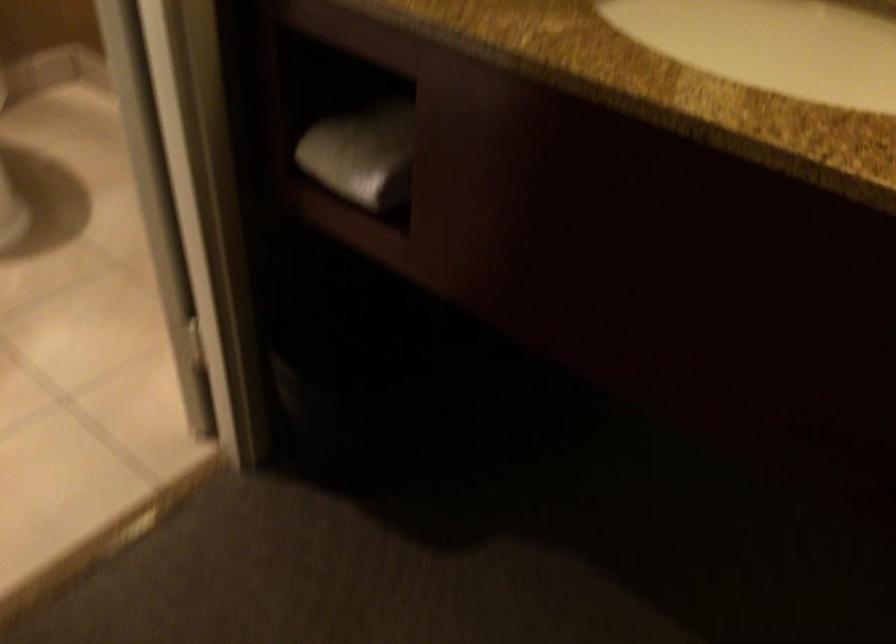
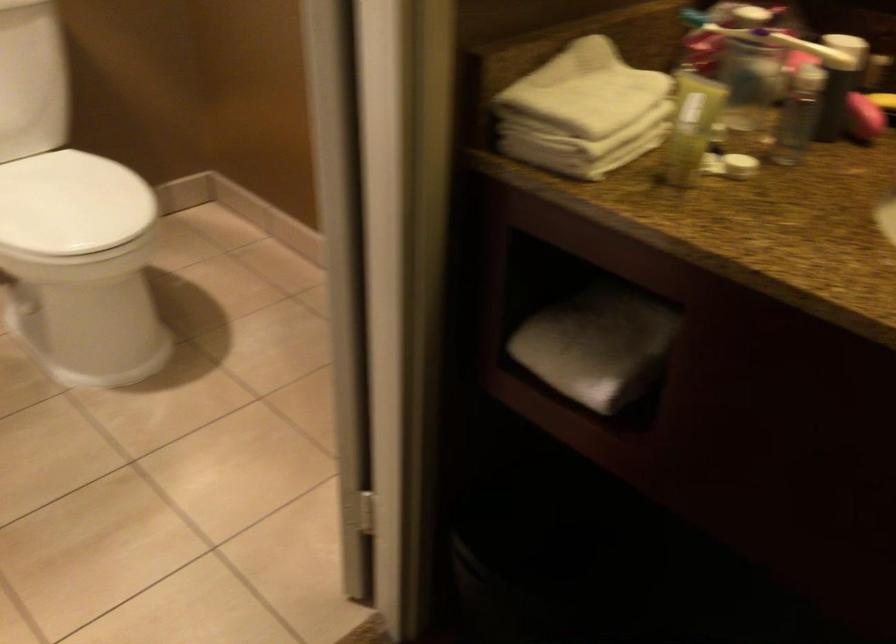
Question: The images are taken continuously from a first-person perspective. In which direction is your viewpoint rotating?

Choices:
 (A) Left
 (B) Right
 (C) Up
 (D) Down

Answer: (C)